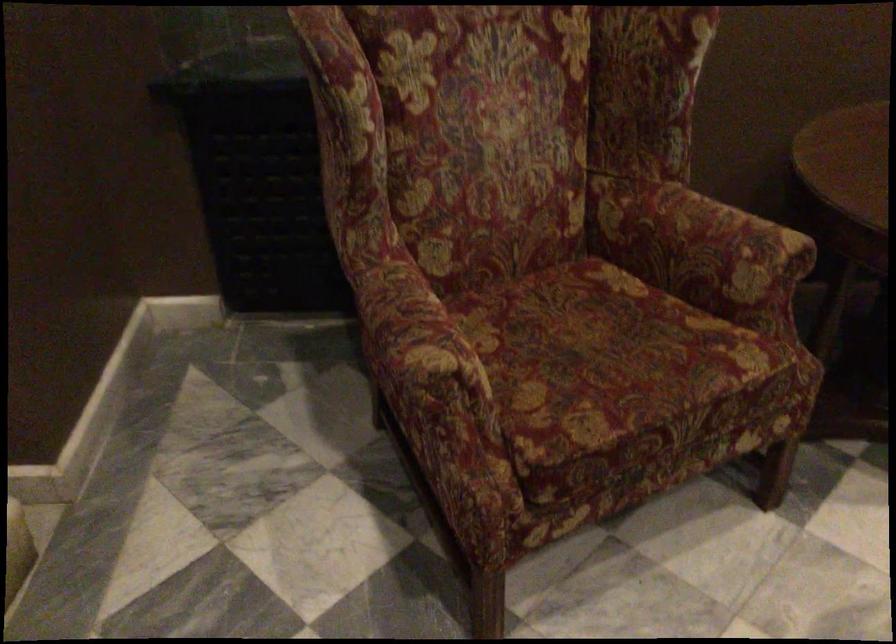
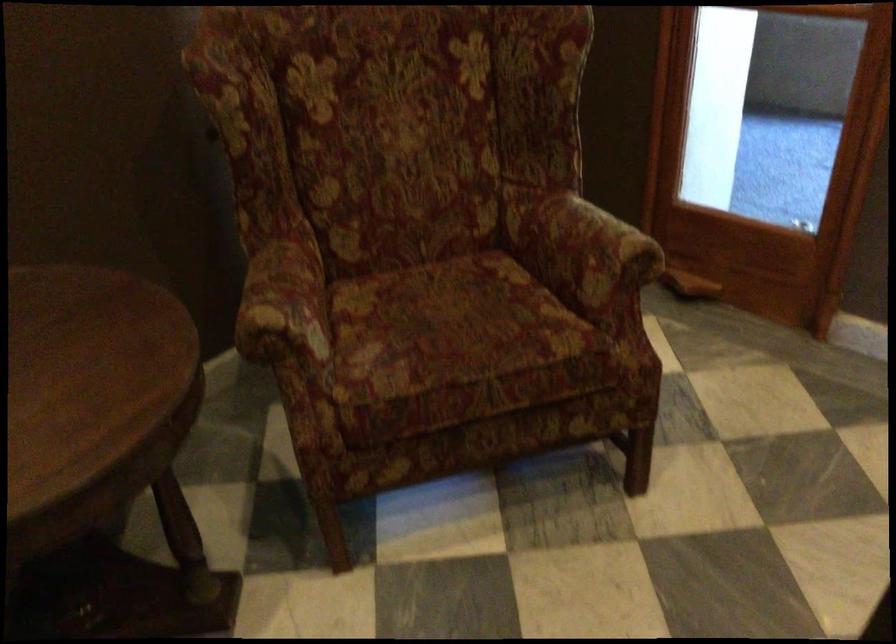
Question: The camera is either moving clockwise (left) or counter-clockwise (right) around the object. The first image is from the beginning of the video and the second image is from the end. Is the camera moving left or right when shooting the video?

Choices:
 (A) Left
 (B) Right

Answer: (A)